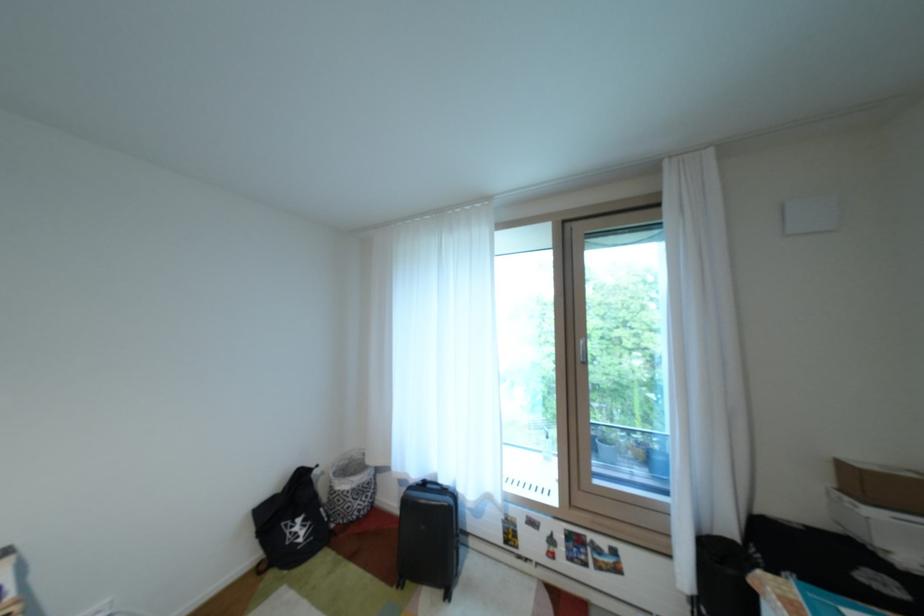
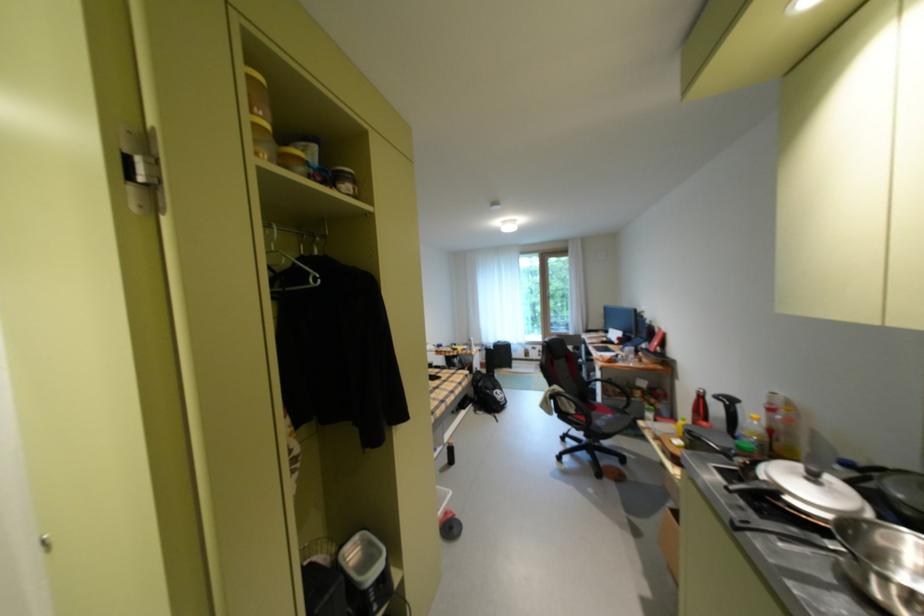
The images are taken continuously from a first-person perspective. In which direction are you moving?

The cameraman moved toward left, backward.